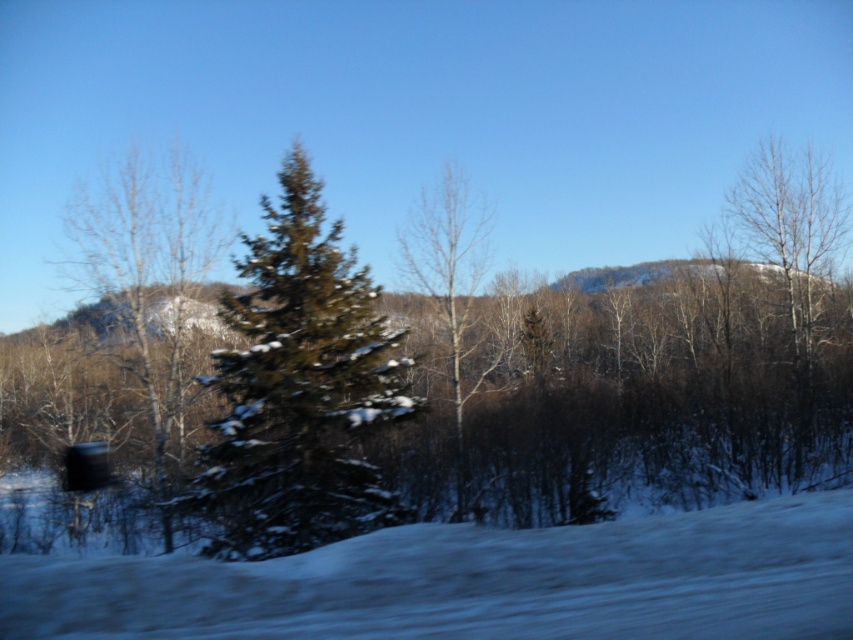
Question: Is white snow at lower center smaller than green textured pine tree at center?

Choices:
 (A) yes
 (B) no

Answer: (B)

Question: Which of these objects is positioned farthest from the bare wood tree at right?

Choices:
 (A) white snow at lower center
 (B) bare wood tree at center
 (C) green matte evergreen at left
 (D) green textured pine tree at center

Answer: (A)

Question: Does white snow at lower center appear over green textured pine tree at center?

Choices:
 (A) yes
 (B) no

Answer: (B)

Question: Which object appears farthest from the camera in this image?

Choices:
 (A) white snow at lower center
 (B) bare wood tree at center
 (C) green textured pine tree at center
 (D) bare wood tree at right

Answer: (D)

Question: Considering the relative positions of green textured pine tree at center and bare wood tree at right in the image provided, where is green textured pine tree at center located with respect to bare wood tree at right?

Choices:
 (A) below
 (B) above

Answer: (A)

Question: Which point appears farthest from the camera in this image?

Choices:
 (A) (422, 237)
 (B) (105, 285)
 (C) (819, 278)
 (D) (358, 328)

Answer: (C)